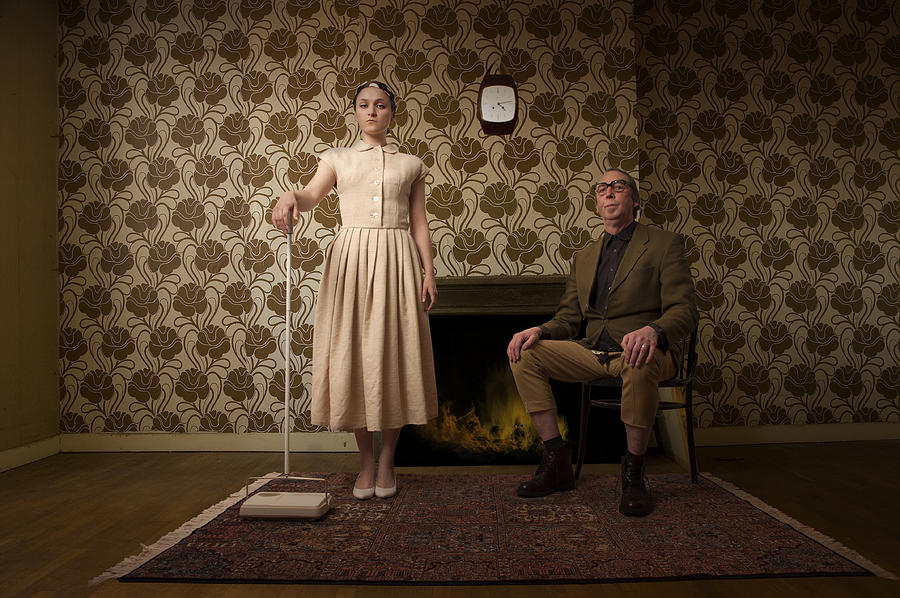
Identify the location of white soft stringy portions of the rug. The height and width of the screenshot is (598, 900). (814, 530), (184, 529).